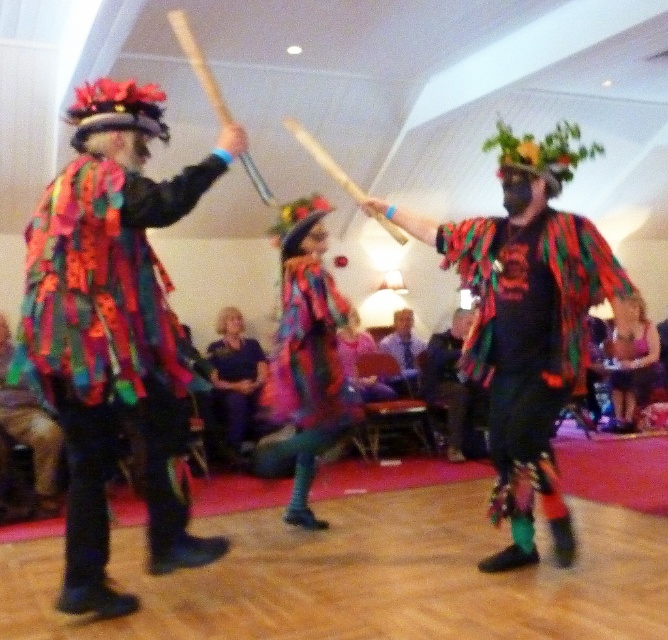
Question: Which point is farther to the camera?

Choices:
 (A) multicolored fabric cape at left
 (B) multicolored fabric costume at center
 (C) multicolored fabric scarf at center

Answer: (B)

Question: Is the position of multicolored fabric scarf at center more distant than that of purple fabric dress at center?

Choices:
 (A) yes
 (B) no

Answer: (B)

Question: Is multicolored fabric cape at left above purple fabric dress at center?

Choices:
 (A) no
 (B) yes

Answer: (B)

Question: Which point appears closest to the camera in this image?

Choices:
 (A) (621, 337)
 (B) (230, 422)

Answer: (B)

Question: Among these objects, which one is farthest from the camera?

Choices:
 (A) multicolored fabric costume at center
 (B) multicolored fabric cape at left
 (C) multicolored fabric scarf at center
 (D) purple fabric dress at center

Answer: (D)

Question: Can you confirm if multicolored fabric scarf at center is positioned above multicolored fabric dress at lower right?

Choices:
 (A) yes
 (B) no

Answer: (A)